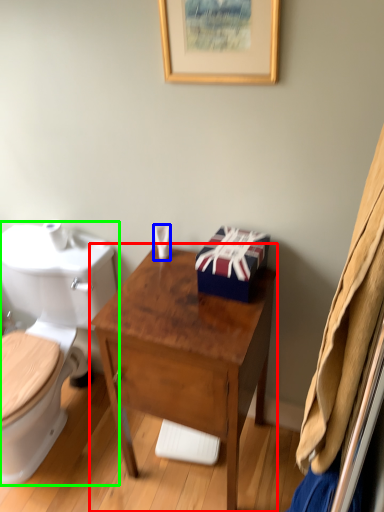
Question: Which is nearer to the desk (highlighted by a red box)? toiletries (highlighted by a blue box) or toilet (highlighted by a green box).

Choices:
 (A) toiletries
 (B) toilet

Answer: (A)